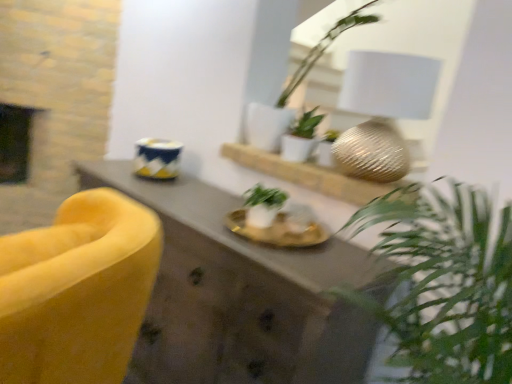
Question: Is the depth of white ceramic plant at upper center, which is the 1th houseplant from top to bottom, less than that of velvet yellow armchair at left?

Choices:
 (A) yes
 (B) no

Answer: (B)

Question: From the image's perspective, does white ceramic plant at upper center, which appears as the third houseplant when ordered from the bottom, appear lower than velvet yellow armchair at left?

Choices:
 (A) yes
 (B) no

Answer: (B)

Question: Could you tell me if white ceramic plant at upper center, which is the 1th houseplant from top to bottom, is facing velvet yellow armchair at left?

Choices:
 (A) yes
 (B) no

Answer: (B)

Question: Does white ceramic plant at upper center, which is the 1th houseplant from top to bottom, come behind velvet yellow armchair at left?

Choices:
 (A) yes
 (B) no

Answer: (A)

Question: From a real-world perspective, does white ceramic plant at upper center, which is the 1th houseplant from top to bottom, sit lower than velvet yellow armchair at left?

Choices:
 (A) yes
 (B) no

Answer: (B)

Question: Considering the positions of point (304, 152) and point (373, 79), is point (304, 152) closer or farther from the camera than point (373, 79)?

Choices:
 (A) farther
 (B) closer

Answer: (A)

Question: Based on their sizes in the image, would you say white matte plant at center, the 2th houseplant from the bottom, is bigger or smaller than textured gold lampshade at upper right?

Choices:
 (A) big
 (B) small

Answer: (B)

Question: Would you say white matte plant at center, placed as the 2th houseplant when sorted from top to bottom, is to the left or to the right of textured gold lampshade at upper right in the picture?

Choices:
 (A) right
 (B) left

Answer: (B)

Question: Would you say white matte plant at center, the 2th houseplant from the bottom, is inside or outside textured gold lampshade at upper right?

Choices:
 (A) outside
 (B) inside

Answer: (A)

Question: Is white matte plant at center, the 2th houseplant from the bottom, inside or outside of metallic gold sphere at center?

Choices:
 (A) outside
 (B) inside

Answer: (A)

Question: From a real-world perspective, is white matte plant at center, placed as the 2th houseplant when sorted from top to bottom, positioned above or below metallic gold sphere at center?

Choices:
 (A) below
 (B) above

Answer: (B)

Question: Is point (296, 122) closer or farther from the camera than point (287, 175)?

Choices:
 (A) farther
 (B) closer

Answer: (A)

Question: Considering the positions of white matte plant at center, placed as the 2th houseplant when sorted from top to bottom, and metallic gold sphere at center in the image, is white matte plant at center, placed as the 2th houseplant when sorted from top to bottom, bigger or smaller than metallic gold sphere at center?

Choices:
 (A) small
 (B) big

Answer: (A)

Question: Considering the positions of point [228, 152] and point [314, 377], is point [228, 152] closer or farther from the camera than point [314, 377]?

Choices:
 (A) farther
 (B) closer

Answer: (A)

Question: From a real-world perspective, is metallic gold sphere at center physically located above or below velvet yellow armchair at left?

Choices:
 (A) below
 (B) above

Answer: (B)